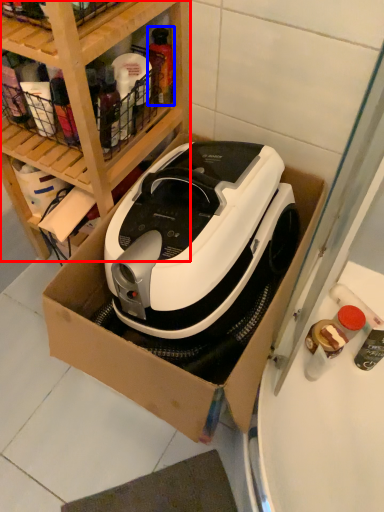
Question: Which of the following is the closest to the observer, shelf (highlighted by a red box) or bottle (highlighted by a blue box)?

Choices:
 (A) shelf
 (B) bottle

Answer: (A)